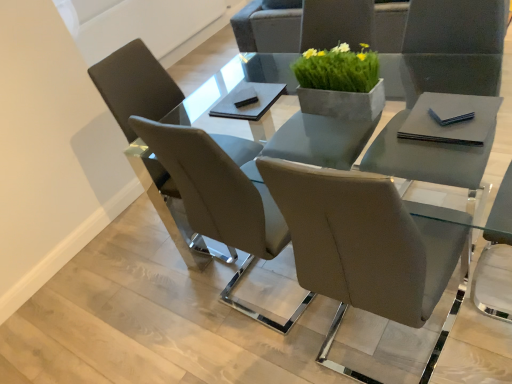
Describe the element at coordinates (139, 138) in the screenshot. I see `matte gray chair at left, the 2th chair viewed from the front` at that location.

The width and height of the screenshot is (512, 384). I want to click on matte gray chair at left, which ranks as the 1th chair in back-to-front order, so click(139, 138).

Image resolution: width=512 pixels, height=384 pixels. In order to click on green concrete planter at center in this screenshot , I will do `click(340, 83)`.

Image resolution: width=512 pixels, height=384 pixels. Find the location of `matte gray chair at left, which ranks as the 1th chair in back-to-front order`. matte gray chair at left, which ranks as the 1th chair in back-to-front order is located at coordinates (139, 138).

Is clear glass table at center taller than matte gray chair at center, the 2th chair positioned from the back?

No, clear glass table at center is not taller than matte gray chair at center, the 2th chair positioned from the back.

Does clear glass table at center appear on the right side of matte gray chair at center, acting as the first chair starting from the front?

Yes.

Is clear glass table at center positioned before matte gray chair at center, acting as the first chair starting from the front?

Yes, clear glass table at center is in front of matte gray chair at center, acting as the first chair starting from the front.

From the image's perspective, is matte gray chair at left, the 2th chair viewed from the front, located above clear glass table at center?

Indeed, from the image's perspective, matte gray chair at left, the 2th chair viewed from the front, is shown above clear glass table at center.

Based on their sizes in the image, would you say matte gray chair at left, which ranks as the 1th chair in back-to-front order, is bigger or smaller than clear glass table at center?

Considering their sizes, matte gray chair at left, which ranks as the 1th chair in back-to-front order, takes up less space than clear glass table at center.

Does point (122, 126) come behind point (202, 243)?

No.

From the image's perspective, is matte gray chair at center, the 2th chair positioned from the back, positioned above or below clear glass table at center?

From the image's perspective, matte gray chair at center, the 2th chair positioned from the back, appears below clear glass table at center.

Is clear glass table at center a part of matte gray chair at center, acting as the first chair starting from the front?

No, clear glass table at center is not inside matte gray chair at center, acting as the first chair starting from the front.

From a real-world perspective, is matte gray chair at center, acting as the first chair starting from the front, on clear glass table at center?

Indeed, from a real-world perspective, matte gray chair at center, acting as the first chair starting from the front, stands above clear glass table at center.

Considering the points (209, 144) and (245, 122), which point is behind, point (209, 144) or point (245, 122)?

The point (245, 122) is farther.

Does matte gray chair at left, the 2th chair viewed from the front, have a larger size compared to green concrete planter at center?

Yes, matte gray chair at left, the 2th chair viewed from the front, is bigger than green concrete planter at center.

From a real-world perspective, which is physically below, matte gray chair at left, the 2th chair viewed from the front, or green concrete planter at center?

matte gray chair at left, the 2th chair viewed from the front, is physically lower.

Considering the relative positions of matte gray chair at left, which ranks as the 1th chair in back-to-front order, and green concrete planter at center in the image provided, is matte gray chair at left, which ranks as the 1th chair in back-to-front order, in front of green concrete planter at center?

That is False.

Is matte gray chair at center, the 2th chair positioned from the back, positioned far away from green concrete planter at center?

matte gray chair at center, the 2th chair positioned from the back, is near green concrete planter at center, not far away.

Is matte gray chair at center, acting as the first chair starting from the front, positioned behind green concrete planter at center?

No, the depth of matte gray chair at center, acting as the first chair starting from the front, is less than that of green concrete planter at center.

Can you confirm if matte gray chair at center, acting as the first chair starting from the front, is shorter than green concrete planter at center?

In fact, matte gray chair at center, acting as the first chair starting from the front, may be taller than green concrete planter at center.

Would you say matte gray chair at center, the 2th chair positioned from the back, contains green concrete planter at center?

No, green concrete planter at center is not surrounded by matte gray chair at center, the 2th chair positioned from the back.

Considering the sizes of green concrete planter at center and matte gray chair at left, the 2th chair viewed from the front, in the image, is green concrete planter at center taller or shorter than matte gray chair at left, the 2th chair viewed from the front,?

green concrete planter at center is shorter than matte gray chair at left, the 2th chair viewed from the front.

Considering the positions of objects green concrete planter at center and matte gray chair at left, the 2th chair viewed from the front, in the image provided, who is behind, green concrete planter at center or matte gray chair at left, the 2th chair viewed from the front,?

matte gray chair at left, the 2th chair viewed from the front, is behind.

Does green concrete planter at center have a larger size compared to matte gray chair at left, the 2th chair viewed from the front?

No, green concrete planter at center is not bigger than matte gray chair at left, the 2th chair viewed from the front.

From a real-world perspective, between green concrete planter at center and matte gray chair at left, which ranks as the 1th chair in back-to-front order, who is vertically lower?

matte gray chair at left, which ranks as the 1th chair in back-to-front order, from a real-world perspective.

Considering the relative sizes of clear glass table at center and matte gray chair at left, the 2th chair viewed from the front, in the image provided, is clear glass table at center thinner than matte gray chair at left, the 2th chair viewed from the front,?

No, clear glass table at center is not thinner than matte gray chair at left, the 2th chair viewed from the front.

Could you tell me if clear glass table at center is turned towards matte gray chair at left, which ranks as the 1th chair in back-to-front order?

No, clear glass table at center is not turned towards matte gray chair at left, which ranks as the 1th chair in back-to-front order.

Is the depth of clear glass table at center less than that of matte gray chair at left, which ranks as the 1th chair in back-to-front order?

Yes, it is in front of matte gray chair at left, which ranks as the 1th chair in back-to-front order.

From a real-world perspective, is clear glass table at center below matte gray chair at left, the 2th chair viewed from the front?

Yes, from a real-world perspective, clear glass table at center is beneath matte gray chair at left, the 2th chair viewed from the front.

Where is `chair that is the 1st one when counting leftward from the clear glass table at center`? The height and width of the screenshot is (384, 512). chair that is the 1st one when counting leftward from the clear glass table at center is located at coordinates (220, 201).

Find the location of `round table that is under the matte gray chair at left, the 2th chair viewed from the front (from a real-world perspective)`. round table that is under the matte gray chair at left, the 2th chair viewed from the front (from a real-world perspective) is located at coordinates (230, 90).

When comparing their distances from green concrete planter at center, does matte gray chair at center, acting as the first chair starting from the front, or clear glass table at center seem closer?

The object closer to green concrete planter at center is matte gray chair at center, acting as the first chair starting from the front.

Estimate the real-world distances between objects in this image. Which object is further from clear glass table at center, matte gray chair at left, which ranks as the 1th chair in back-to-front order, or green concrete planter at center?

The object further to clear glass table at center is green concrete planter at center.

Based on their spatial positions, is matte gray chair at left, the 2th chair viewed from the front, or clear glass table at center closer to green concrete planter at center?

matte gray chair at left, the 2th chair viewed from the front, is positioned closer to the anchor green concrete planter at center.

Which object lies further to the anchor point matte gray chair at left, which ranks as the 1th chair in back-to-front order, green concrete planter at center or clear glass table at center?

Based on the image, clear glass table at center appears to be further to matte gray chair at left, which ranks as the 1th chair in back-to-front order.

Which object lies nearer to the anchor point matte gray chair at left, the 2th chair viewed from the front, clear glass table at center or matte gray chair at center, acting as the first chair starting from the front?

matte gray chair at center, acting as the first chair starting from the front, is closer to matte gray chair at left, the 2th chair viewed from the front.

Estimate the real-world distances between objects in this image. Which object is closer to green concrete planter at center, clear glass table at center or matte gray chair at center, the 2th chair positioned from the back?

Based on the image, matte gray chair at center, the 2th chair positioned from the back, appears to be nearer to green concrete planter at center.

Estimate the real-world distances between objects in this image. Which object is further from green concrete planter at center, matte gray chair at center, the 2th chair positioned from the back, or matte gray chair at left, which ranks as the 1th chair in back-to-front order?

matte gray chair at left, which ranks as the 1th chair in back-to-front order, is positioned further to the anchor green concrete planter at center.

From the image, which object appears to be nearer to matte gray chair at center, acting as the first chair starting from the front, clear glass table at center or matte gray chair at left, the 2th chair viewed from the front?

Based on the image, matte gray chair at left, the 2th chair viewed from the front, appears to be nearer to matte gray chair at center, acting as the first chair starting from the front.

What are the coordinates of `chair between matte gray chair at left, which ranks as the 1th chair in back-to-front order, and clear glass table at center` in the screenshot? It's located at (220, 201).

The image size is (512, 384). I want to click on chair situated between matte gray chair at left, the 2th chair viewed from the front, and green concrete planter at center from left to right, so click(220, 201).

This screenshot has width=512, height=384. I want to click on round table between green concrete planter at center and matte gray chair at center, the 2th chair positioned from the back, from top to bottom, so click(230, 90).

Where is `houseplant between matte gray chair at left, the 2th chair viewed from the front, and clear glass table at center, in the horizontal direction`? houseplant between matte gray chair at left, the 2th chair viewed from the front, and clear glass table at center, in the horizontal direction is located at coordinates (340, 83).